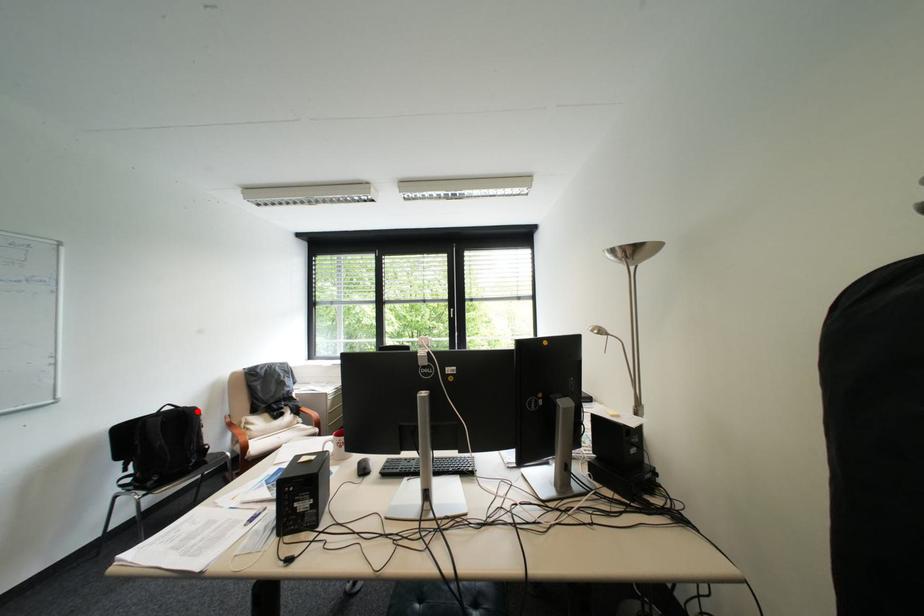
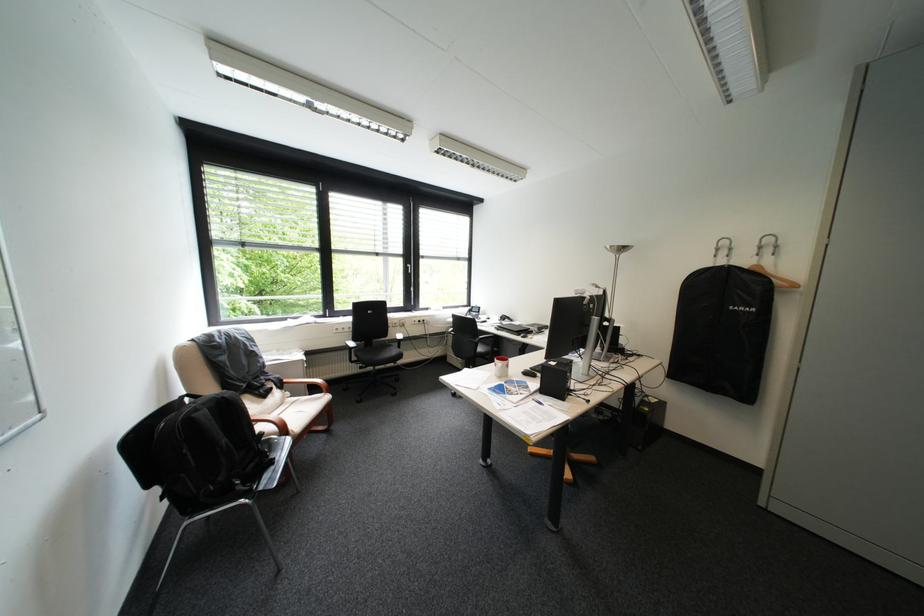
Question: I am providing you with two images of the same scene from different viewpoints. Image1 has a red point marked. In image2, the corresponding 3D location appears at what relative position? Reply with the corresponding letter.

Choices:
 (A) Closer
 (B) Farther

Answer: (A)